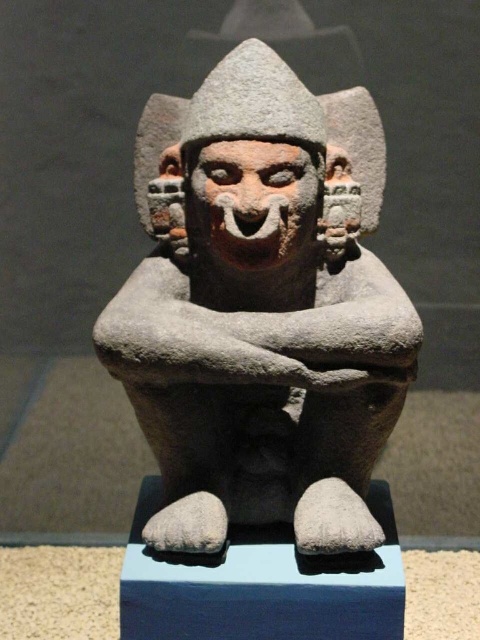
Between point (196, 90) and point (229, 109), which one is positioned behind?

Positioned behind is point (196, 90).

Is point (255, 211) positioned in front of point (194, 115)?

Yes, it is in front of point (194, 115).

Locate an element on the screen. This screenshot has width=480, height=640. gray stone statue at center is located at coordinates (261, 308).